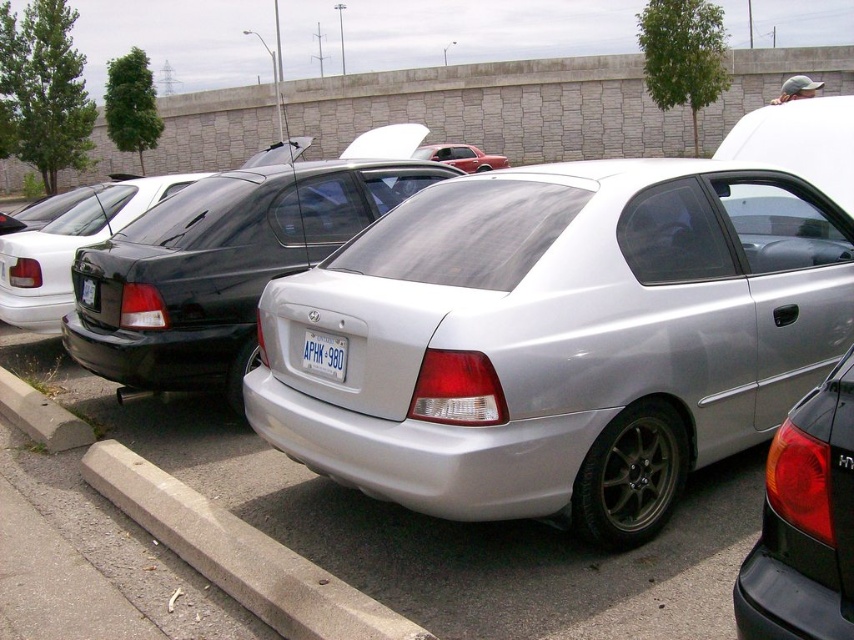
You are a parking attendant and need to locate the white plastic license plate at center for a customer. Based on the scene description, where would you find it relative to the matte black car at center?

The white plastic license plate at center is positioned under the matte black car at center, so it is located beneath the matte black car at center.

You are a delivery person trying to read the license plate of the matte black car at center. However, you notice the white plastic license plate at center is blocking your view. Which object is smaller in height and therefore might be the one causing the obstruction?

The white plastic license plate at center has a lesser height compared to matte black car at center, so it is the smaller object and likely the one blocking the view.

You are a delivery person trying to unload a package that requires a height clearance of 1.8 meters. You observe the satin silver car at center and the matte black tail light at center right in the parking lot. Which object would you need to avoid to ensure the package can pass under it?

The satin silver car at center is not as tall as matte black tail light at center right, so you should avoid the matte black tail light at center right because it is taller and may obstruct the package with its height clearance requirement.